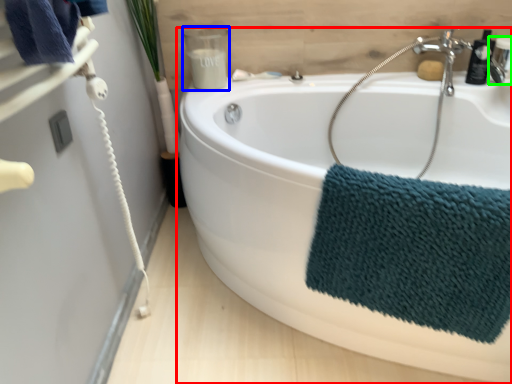
Question: Estimate the real-world distances between objects in this image. Which object is farther from bathtub (highlighted by a red box), toiletry (highlighted by a blue box) or plumbing fixture (highlighted by a green box)?

Choices:
 (A) toiletry
 (B) plumbing fixture

Answer: (B)